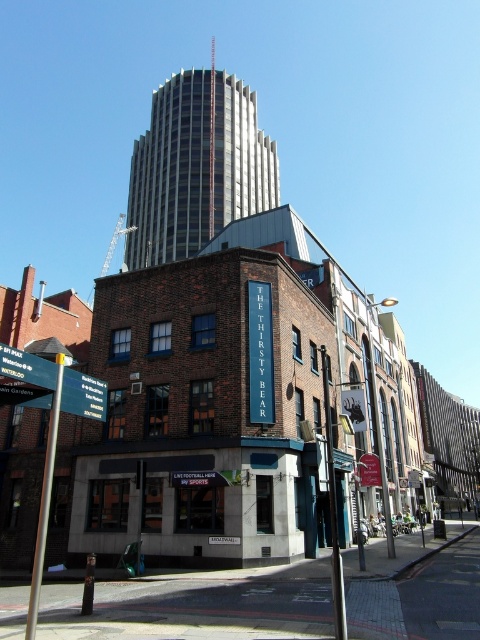
Question: Can you confirm if gray concrete skyscraper at center is smaller than green plastic signpost at lower left?

Choices:
 (A) yes
 (B) no

Answer: (B)

Question: Among these objects, which one is nearest to the camera?

Choices:
 (A) gray concrete skyscraper at center
 (B) green plastic signpost at lower left

Answer: (B)

Question: From the image, what is the correct spatial relationship of gray concrete skyscraper at center in relation to green plastic signpost at lower left?

Choices:
 (A) left
 (B) right

Answer: (A)

Question: Which of the following is the farthest from the observer?

Choices:
 (A) green plastic signpost at lower left
 (B) gray concrete skyscraper at center

Answer: (B)

Question: Considering the relative positions of gray concrete skyscraper at center and green plastic signpost at lower left in the image provided, where is gray concrete skyscraper at center located with respect to green plastic signpost at lower left?

Choices:
 (A) left
 (B) right

Answer: (A)